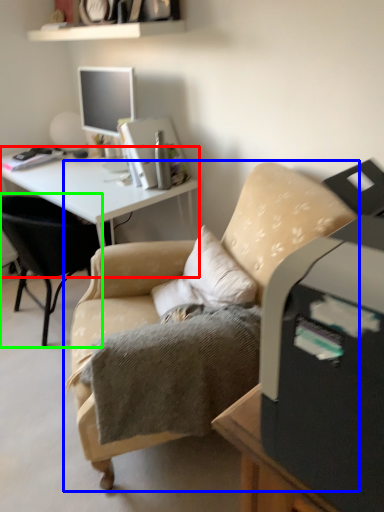
Question: Which object is the closest to the desk (highlighted by a red box)? Choose among these: chair (highlighted by a blue box) or chair (highlighted by a green box).

Choices:
 (A) chair
 (B) chair

Answer: (B)